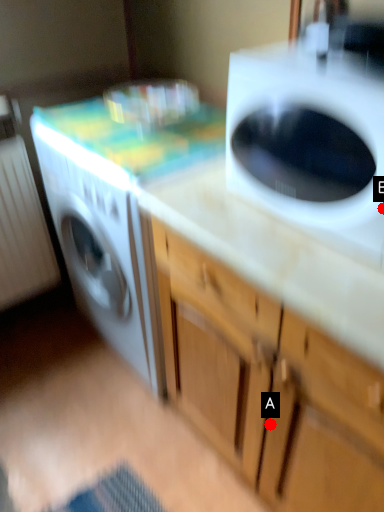
Question: Two points are circled on the image, labeled by A and B beside each circle. Which point is farther from the camera taking this photo?

Choices:
 (A) A is further
 (B) B is further

Answer: (A)